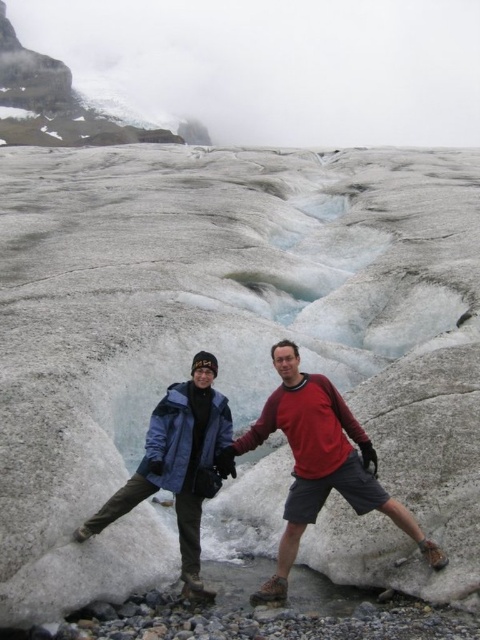
You are a photographer planning to take a portrait of two people standing on a glacier. You want to ensure that the matte red shirt at center and the blue jacket at center are visible in the frame. Based on their positions, which one is more to the right?

The matte red shirt at center is positioned on the right side of blue jacket at center, so the matte red shirt at center is more to the right.

You are a photographer positioned at the edge of the glacier. You want to take a photo that includes both the matte red shirt at center and the blue jacket at center. Which of the two will appear larger in the photo?

The matte red shirt at center will appear larger in the photo because it is closer to the viewer than the blue jacket at center.

You are a photographer planning to take a portrait of the two people in the scene. You want to ensure that both the matte red shirt at center and the blue jacket at center are clearly visible in the frame. Given their heights, which clothing item should you focus on to ensure both are in focus?

The matte red shirt at center is taller than the blue jacket at center. To ensure both are in focus, focus on the matte red shirt at center as it is the taller object, allowing the blue jacket at center to remain within the depth of field.